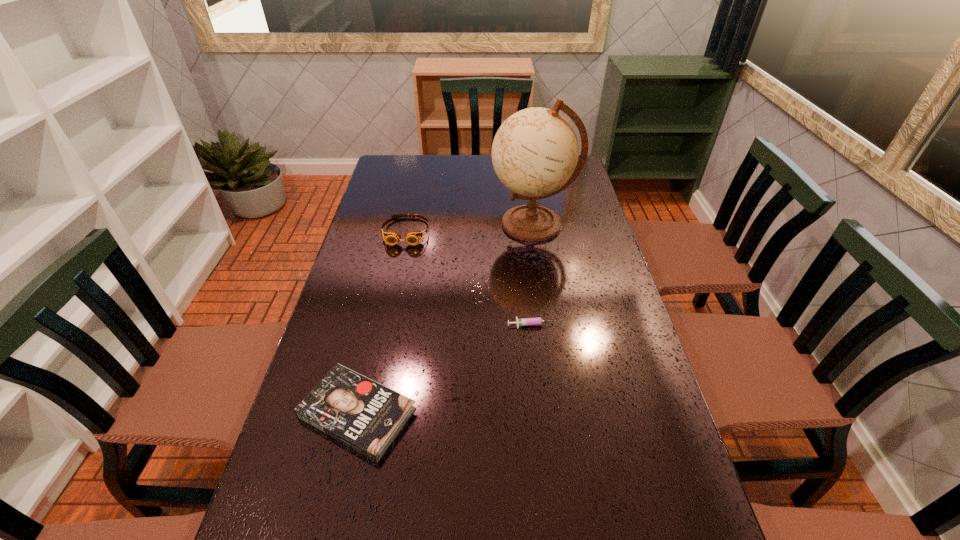
Locate an element on the screen. This screenshot has width=960, height=540. vacant region located 0.100m on the back of the third tallest object is located at coordinates (374, 338).

Locate an element on the screen. This screenshot has width=960, height=540. free space located 0.240m on the left of the syringe is located at coordinates (414, 326).

Identify the location of goggles situated at the left edge. (392, 238).

Find the location of `book at the left edge`. book at the left edge is located at coordinates (361, 413).

This screenshot has height=540, width=960. Find the location of `object that is positioned at the right edge`. object that is positioned at the right edge is located at coordinates (535, 151).

In the image, there is a desktop. Identify the location of vacant space at the far edge. (433, 173).

At what (x,y) coordinates should I click in order to perform the action: click on blank space at the left edge of the desktop. Please return your answer as a coordinate pair (x, y). Looking at the image, I should click on (283, 527).

The image size is (960, 540). I want to click on vacant space at the right edge, so click(661, 501).

Locate an element on the screen. This screenshot has width=960, height=540. free space between the nearest object and the shortest object is located at coordinates (446, 369).

Where is `free space between the nearest object and the globe`? The width and height of the screenshot is (960, 540). free space between the nearest object and the globe is located at coordinates pyautogui.click(x=445, y=319).